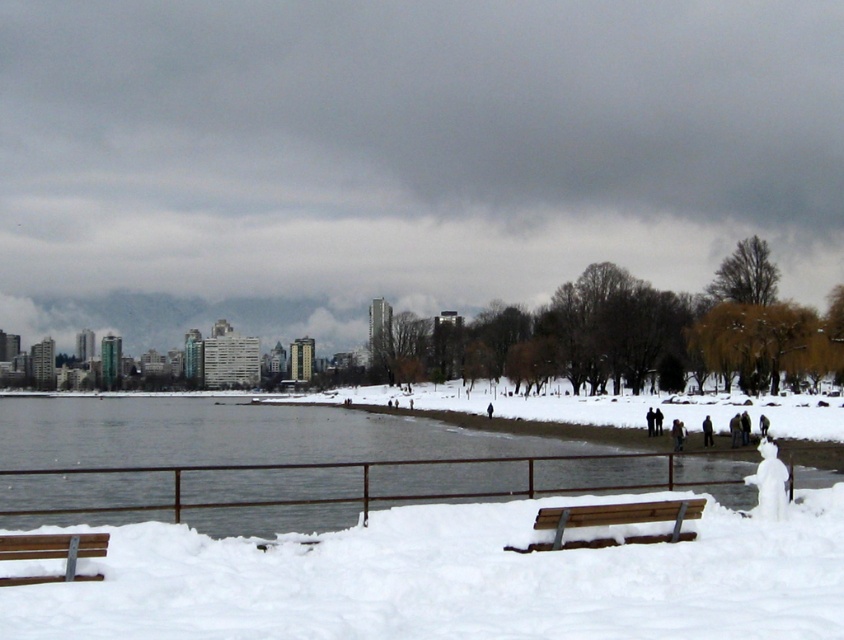
Question: Can you confirm if gray metallic river at center is wider than wooden park bench at lower left?

Choices:
 (A) no
 (B) yes

Answer: (B)

Question: Which object appears farthest from the camera in this image?

Choices:
 (A) wooden park bench at lower left
 (B) white fluffy snow at lower center

Answer: (A)

Question: Which point is farther to the camera?

Choices:
 (A) (95, 579)
 (B) (111, 435)

Answer: (B)

Question: Can you confirm if white fluffy snow at lower center is positioned to the right of gray metallic river at center?

Choices:
 (A) yes
 (B) no

Answer: (A)

Question: Is gray metallic river at center bigger than wooden park bench at lower left?

Choices:
 (A) no
 (B) yes

Answer: (B)

Question: Which of these objects is positioned farthest from the gray metallic river at center?

Choices:
 (A) wooden park bench at lower left
 (B) wooden bench at lower center
 (C) white fluffy snow at lower center

Answer: (B)